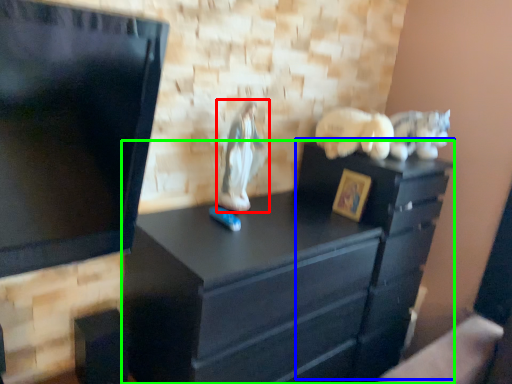
Question: Estimate the real-world distances between objects in this image. Which object is closer to animal (highlighted by a red box), file cabinet (highlighted by a blue box) or chest of drawers (highlighted by a green box)?

Choices:
 (A) file cabinet
 (B) chest of drawers

Answer: (B)